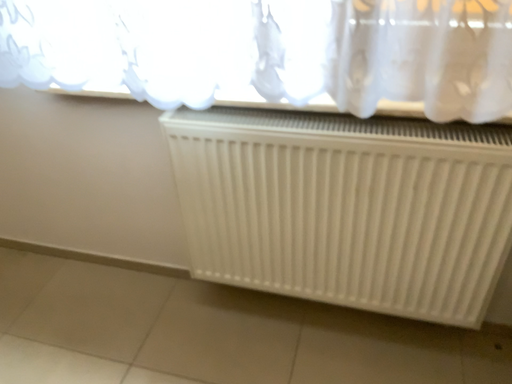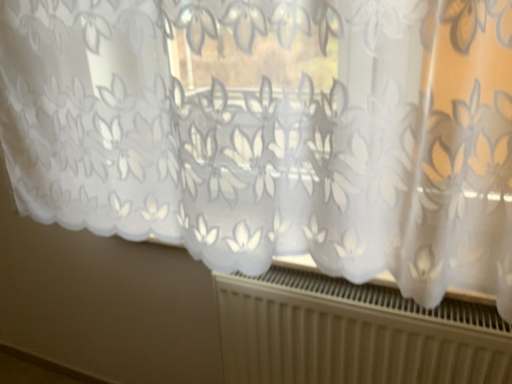
Question: Which way did the camera rotate in the video?

Choices:
 (A) rotated upward
 (B) rotated downward

Answer: (A)